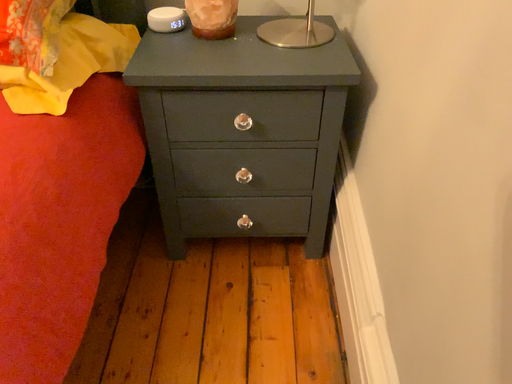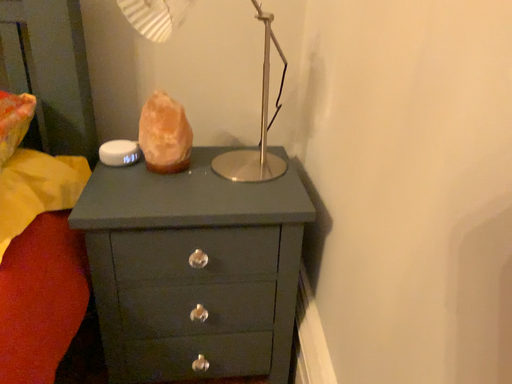
Question: Which way did the camera rotate in the video?

Choices:
 (A) rotated upward
 (B) rotated downward

Answer: (A)